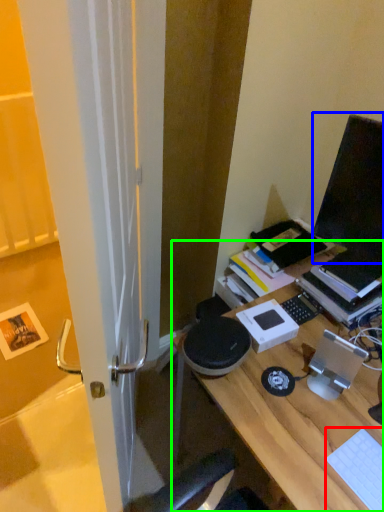
Question: Based on their relative distances, which object is farther from laptop keyboard (highlighted by a red box)? Choose from computer monitor (highlighted by a blue box) and desk (highlighted by a green box).

Choices:
 (A) computer monitor
 (B) desk

Answer: (A)